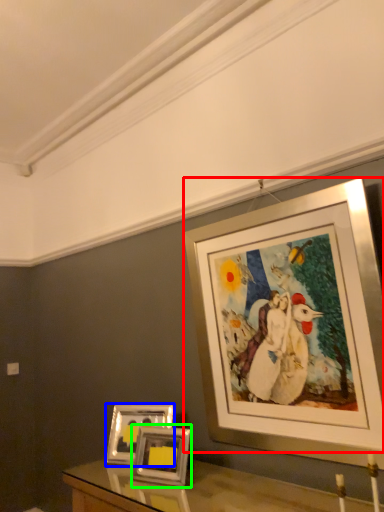
Question: Estimate the real-world distances between objects in this image. Which object is farther from picture frame (highlighted by a red box), picture frame (highlighted by a blue box) or picture frame (highlighted by a green box)?

Choices:
 (A) picture frame
 (B) picture frame

Answer: (A)